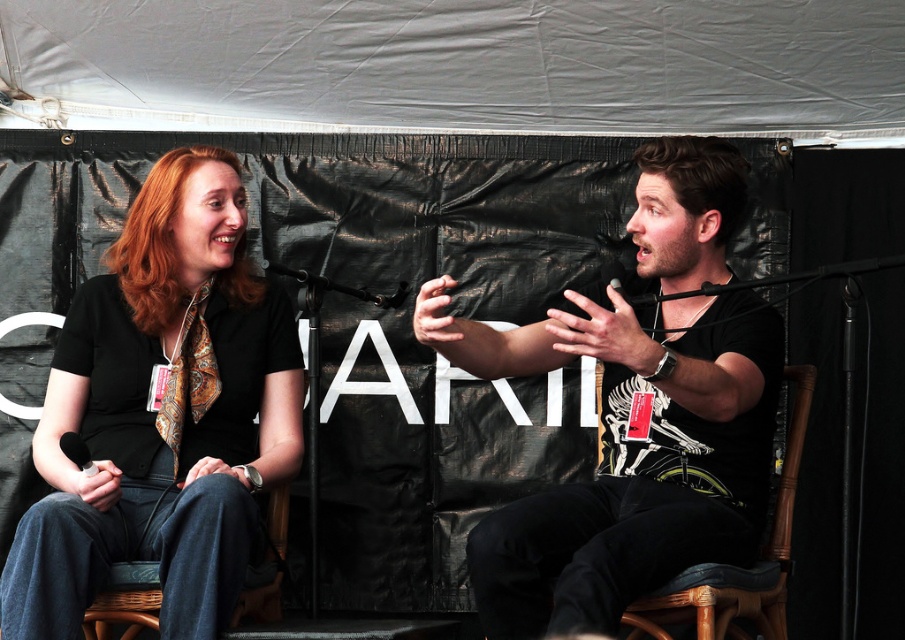
Consider the image. You are setting up a photography session and need to ensure that the matte black shirt at center and the black matte microphone at center are visible in the frame. Given their sizes, which object will appear larger in the photo?

The matte black shirt at center will appear larger in the photo because it has a greater height compared to the black matte microphone at center.

You are standing at the origin point of the coordinate system in the image. Where is the matte black shirt at center located in terms of its 2D coordinates?

The matte black shirt at center is located at coordinates point (162, 413).